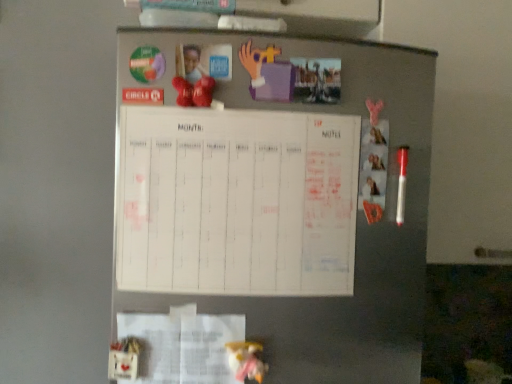
What do you see at coordinates (236, 202) in the screenshot?
I see `white paperboard at center` at bounding box center [236, 202].

This screenshot has height=384, width=512. What do you see at coordinates (182, 345) in the screenshot? I see `white paper at lower left` at bounding box center [182, 345].

The height and width of the screenshot is (384, 512). In order to click on pink paper at right in this screenshot , I will do `click(373, 167)`.

Is pink paper at right surrounded by white paperboard at center?

No, pink paper at right is located outside of white paperboard at center.

Based on the photo, from a real-world perspective, which object stands above the other?

From a 3D spatial view, pink paper at right is above.

Considering the sizes of white paperboard at center and pink paper at right in the image, is white paperboard at center wider or thinner than pink paper at right?

Considering their sizes, white paperboard at center looks broader than pink paper at right.

Considering the sizes of white paperboard at center and pink paper at right in the image, is white paperboard at center taller or shorter than pink paper at right?

white paperboard at center is taller than pink paper at right.

From a real-world perspective, who is located lower, white paper at lower left or white fabric doll at lower center?

From a 3D spatial view, white paper at lower left is below.

Would you consider white paper at lower left to be distant from white fabric doll at lower center?

No, white paper at lower left is in close proximity to white fabric doll at lower center.

Between white paper at lower left and white fabric doll at lower center, which one is positioned in front?

white fabric doll at lower center is more forward.

Does white paper at lower left contain white fabric doll at lower center?

No, white fabric doll at lower center is located outside of white paper at lower left.

Is pink paper at right outside of white fabric doll at lower center?

pink paper at right is positioned outside white fabric doll at lower center.

From the image's perspective, would you say pink paper at right is shown under white fabric doll at lower center?

No.

Is pink paper at right positioned with its back to white fabric doll at lower center?

No, pink paper at right's orientation is not away from white fabric doll at lower center.

Consider the image. Considering the sizes of pink paper at right and white fabric doll at lower center in the image, is pink paper at right wider or thinner than white fabric doll at lower center?

pink paper at right is thinner than white fabric doll at lower center.

Is white paper at lower left completely or partially outside of pink paper at right?

white paper at lower left lies outside pink paper at right's area.

Which is more to the right, white paper at lower left or pink paper at right?

From the viewer's perspective, pink paper at right appears more on the right side.

Is the surface of white paper at lower left in direct contact with pink paper at right?

white paper at lower left and pink paper at right are not in contact.

Can you confirm if white paper at lower left is bigger than white paperboard at center?

Incorrect, white paper at lower left is not larger than white paperboard at center.

Considering the relative positions of white paper at lower left and white paperboard at center in the image provided, is white paper at lower left to the left of white paperboard at center from the viewer's perspective?

Yes, white paper at lower left is to the left of white paperboard at center.

From the image's perspective, which is below, white paper at lower left or white paperboard at center?

white paper at lower left, from the image's perspective.

Measure the distance from white paper at lower left to white paperboard at center.

white paper at lower left is 18.28 centimeters away from white paperboard at center.

At what (x,y) coordinates should I click in order to perform the action: click on poster that appears on the right of white paper at lower left. Please return your answer as a coordinate pair (x, y). This screenshot has width=512, height=384. Looking at the image, I should click on (373, 167).

Visually, is pink paper at right positioned to the left or to the right of white paper at lower left?

pink paper at right is positioned on white paper at lower left's right side.

Based on the photo, is pink paper at right next to white paper at lower left?

No, pink paper at right is not making contact with white paper at lower left.

Between pink paper at right and white paper at lower left, which one is positioned behind?

Positioned behind is pink paper at right.

Between white paperboard at center and white fabric doll at lower center, which one has larger size?

white paperboard at center is bigger.

From the image's perspective, which is below, white paperboard at center or white fabric doll at lower center?

white fabric doll at lower center appears lower in the image.

Visually, is white paperboard at center positioned to the left or to the right of white fabric doll at lower center?

From the image, it's evident that white paperboard at center is to the left of white fabric doll at lower center.

Are white paperboard at center and white fabric doll at lower center making contact?

No, white paperboard at center is not beside white fabric doll at lower center.

You are a GUI agent. You are given a task and a screenshot of the screen. Output one action in this format:
    pyautogui.click(x=<x>, y=<y>)
    Task: Click on the bulletin board in front of the pink paper at right
    The image size is (512, 384).
    Given the screenshot: What is the action you would take?
    pyautogui.click(x=236, y=202)

This screenshot has height=384, width=512. Find the location of `paper below the white fabric doll at lower center (from the image's perspective)`. paper below the white fabric doll at lower center (from the image's perspective) is located at coordinates (182, 345).

When comparing their distances from white paper at lower left, does white fabric doll at lower center or white paperboard at center seem closer?

white fabric doll at lower center is closer to white paper at lower left.

Considering their positions, is pink paper at right positioned closer to white fabric doll at lower center than white paperboard at center?

Based on the image, white paperboard at center appears to be nearer to white fabric doll at lower center.

Considering their positions, is white fabric doll at lower center positioned further to white paper at lower left than pink paper at right?

pink paper at right lies further to white paper at lower left than the other object.

In the scene shown: Estimate the real-world distances between objects in this image. Which object is further from pink paper at right, white paperboard at center or white paper at lower left?

Based on the image, white paper at lower left appears to be further to pink paper at right.

Which object lies nearer to the anchor point white paperboard at center, pink paper at right or white paper at lower left?

white paper at lower left.

Based on their spatial positions, is white paper at lower left or white paperboard at center closer to white fabric doll at lower center?

white paper at lower left is closer to white fabric doll at lower center.

From the image, which object appears to be farther from pink paper at right, white paper at lower left or white paperboard at center?

Based on the image, white paper at lower left appears to be further to pink paper at right.

Estimate the real-world distances between objects in this image. Which object is further from white fabric doll at lower center, white paperboard at center or pink paper at right?

pink paper at right is positioned further to the anchor white fabric doll at lower center.

This screenshot has width=512, height=384. I want to click on toy between pink paper at right and white paper at lower left vertically, so click(246, 360).

Identify the location of toy between white paperboard at center and white paper at lower left from top to bottom. (246, 360).

The height and width of the screenshot is (384, 512). I want to click on bulletin board between pink paper at right and white paper at lower left in the vertical direction, so [236, 202].

Locate an element on the screen. The height and width of the screenshot is (384, 512). bulletin board between pink paper at right and white fabric doll at lower center from top to bottom is located at coordinates point(236,202).